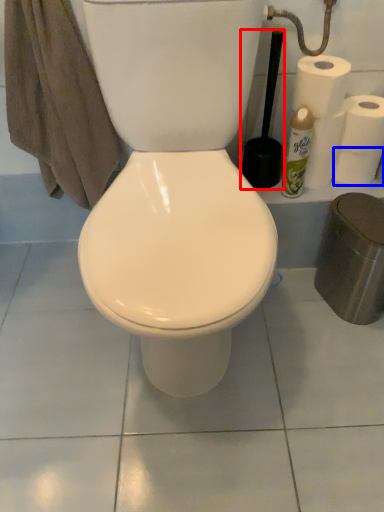
Question: Which object is further to the camera taking this photo, brush (highlighted by a red box) or paper towel (highlighted by a blue box)?

Choices:
 (A) brush
 (B) paper towel

Answer: (B)